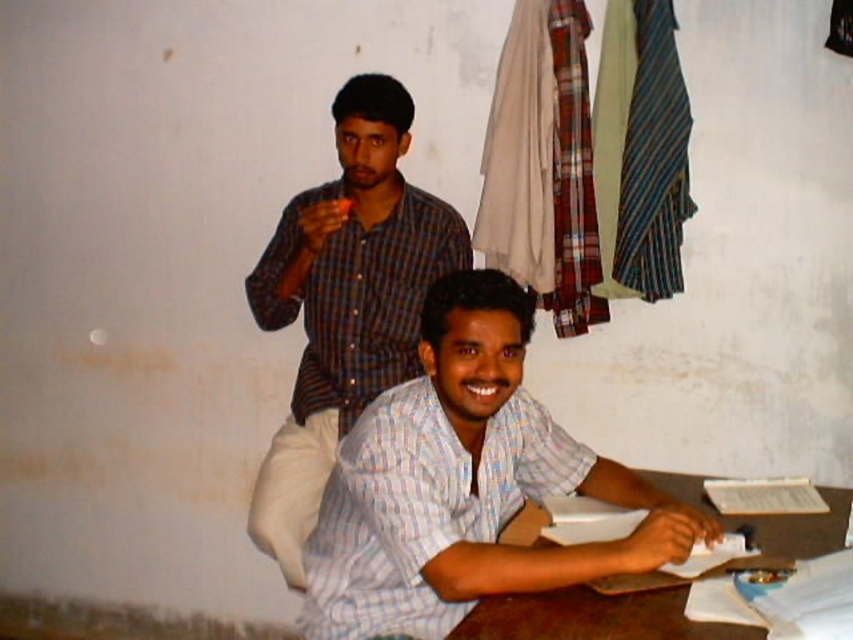
Between point (503, 371) and point (663, 472), which one is positioned behind?

The point (663, 472) is behind.

Between light blue checkered shirt at center and brown wooden table at lower right, which one appears on the left side from the viewer's perspective?

light blue checkered shirt at center

Which is in front, point (421, 470) or point (662, 637)?

Point (662, 637)

This screenshot has width=853, height=640. Find the location of `light blue checkered shirt at center`. light blue checkered shirt at center is located at coordinates (465, 484).

Looking at this image, does light blue checkered shirt at center appear on the left side of checkered fabric shirt at upper center?

Incorrect, light blue checkered shirt at center is not on the left side of checkered fabric shirt at upper center.

Does light blue checkered shirt at center have a larger size compared to checkered fabric shirt at upper center?

No, light blue checkered shirt at center is not bigger than checkered fabric shirt at upper center.

Is point (398, 509) more distant than point (294, 522)?

No, it is in front of (294, 522).

Locate an element on the screen. The height and width of the screenshot is (640, 853). light blue checkered shirt at center is located at coordinates (465, 484).

Can you confirm if checkered fabric shirt at upper center is shorter than brown wooden table at lower right?

No, checkered fabric shirt at upper center is not shorter than brown wooden table at lower right.

Which is more to the right, checkered fabric shirt at upper center or brown wooden table at lower right?

brown wooden table at lower right is more to the right.

Which is behind, point (381, 125) or point (589, 618)?

The point (381, 125) is more distant.

In order to click on checkered fabric shirt at upper center in this screenshot , I will do `click(345, 301)`.